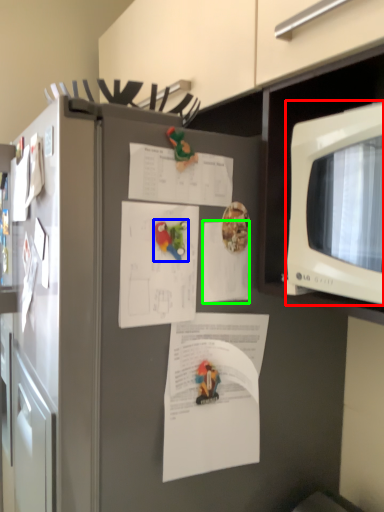
Question: Which object is positioned closest to microwave oven (highlighted by a red box)? Select from toy (highlighted by a blue box) and document (highlighted by a green box).

Choices:
 (A) toy
 (B) document

Answer: (B)